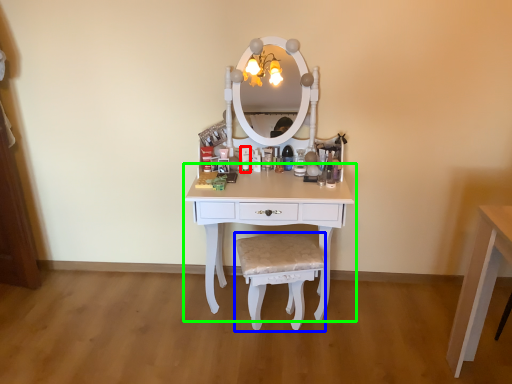
Question: Which object is the closest to the toiletry (highlighted by a red box)? Choose among these: chair (highlighted by a blue box) or table (highlighted by a green box).

Choices:
 (A) chair
 (B) table

Answer: (B)